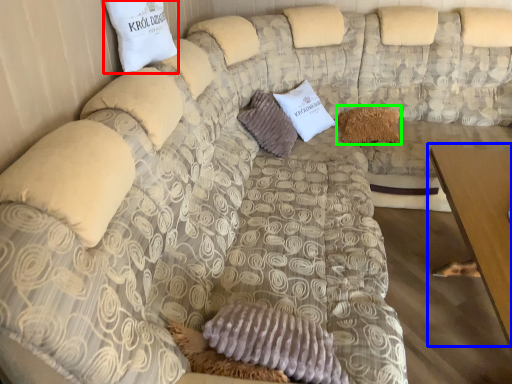
Question: Which object is positioned closest to pillow (highlighted by a red box)? Select from table (highlighted by a blue box) and pillow (highlighted by a green box).

Choices:
 (A) table
 (B) pillow

Answer: (A)